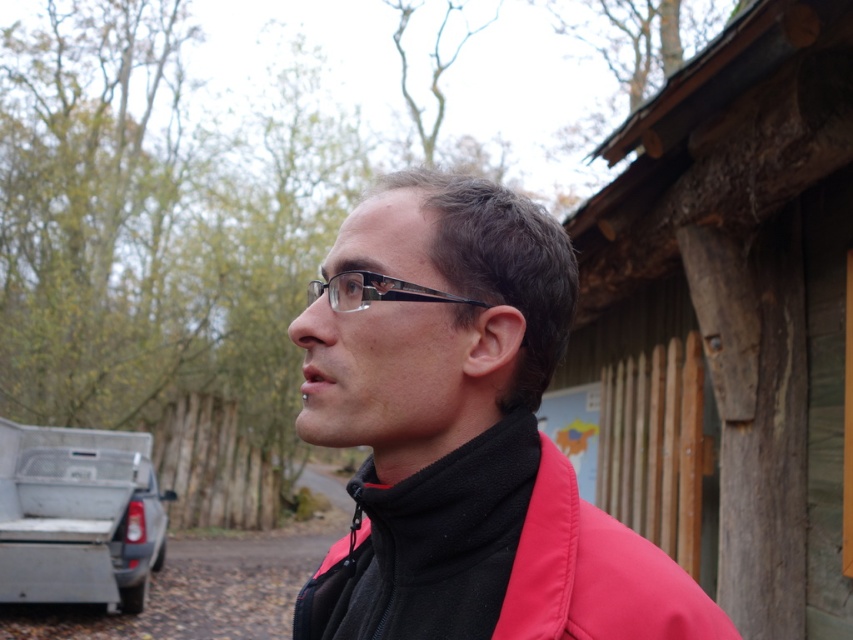
Question: Which point is closer to the camera?

Choices:
 (A) (22, 426)
 (B) (759, 42)
 (C) (329, 282)

Answer: (C)

Question: Is wooden at right further to the viewer compared to black plastic glasses at center?

Choices:
 (A) yes
 (B) no

Answer: (A)

Question: Estimate the real-world distances between objects in this image. Which object is closer to the wooden at right?

Choices:
 (A) black plastic glasses at center
 (B) pink matte jacket at center
 (C) pink fleece jacket at center
 (D) silver metallic truck at lower left

Answer: (B)

Question: Does wooden at right appear on the left side of pink matte jacket at center?

Choices:
 (A) no
 (B) yes

Answer: (A)

Question: Does pink matte jacket at center have a greater width compared to black plastic glasses at center?

Choices:
 (A) yes
 (B) no

Answer: (A)

Question: Which of these objects is positioned farthest from the silver metallic truck at lower left?

Choices:
 (A) black plastic glasses at center
 (B) pink fleece jacket at center

Answer: (A)